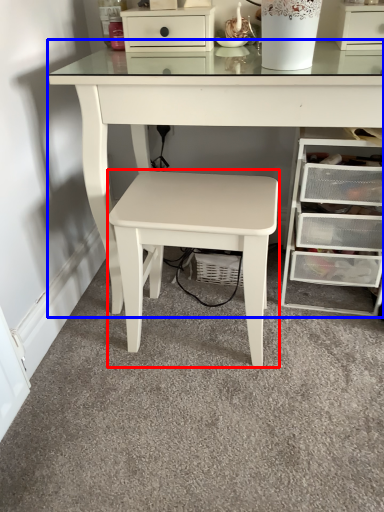
Question: Which object is closer to the camera taking this photo, stool (highlighted by a red box) or table (highlighted by a blue box)?

Choices:
 (A) stool
 (B) table

Answer: (B)